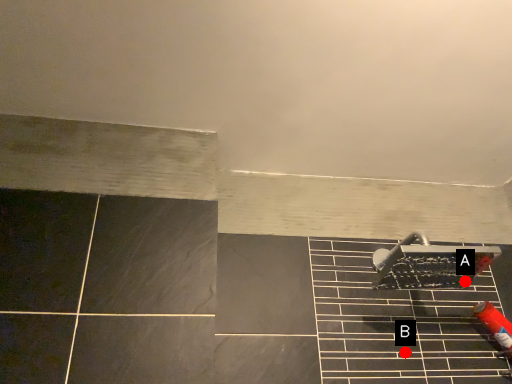
Question: Two points are circled on the image, labeled by A and B beside each circle. Which point is farther from the camera taking this photo?

Choices:
 (A) A is further
 (B) B is further

Answer: (A)